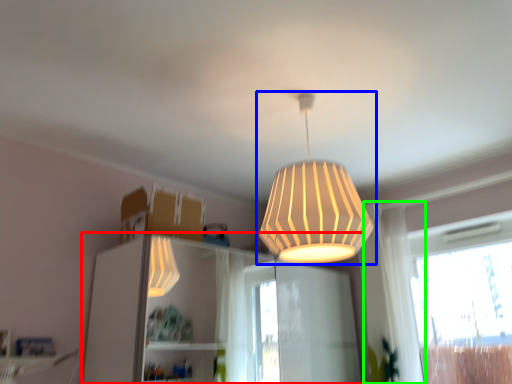
Question: Which object is positioned farthest from dresser (highlighted by a red box)? Select from lamp (highlighted by a blue box) and curtain (highlighted by a green box).

Choices:
 (A) lamp
 (B) curtain

Answer: (A)